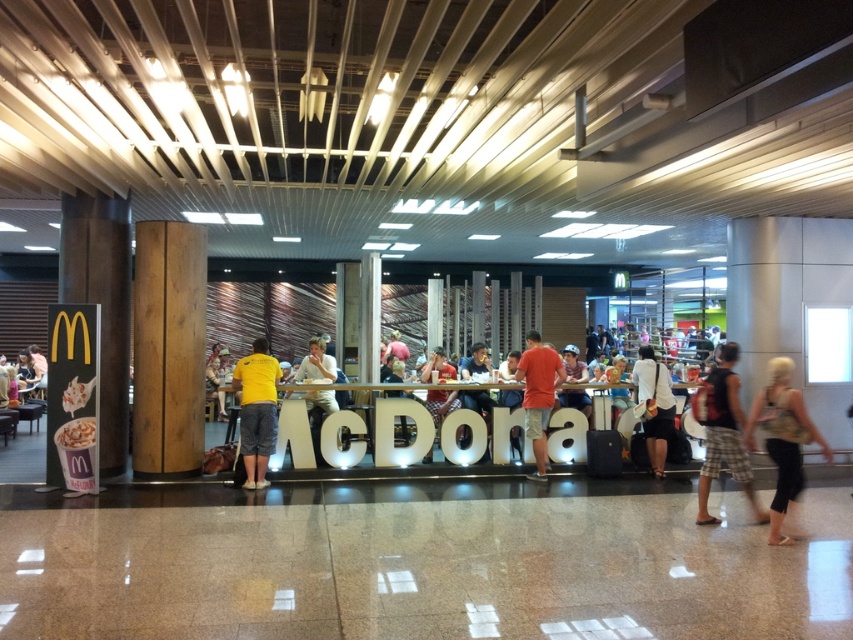
The image size is (853, 640). Describe the element at coordinates (654, 404) in the screenshot. I see `white fabric bag at center` at that location.

Who is higher up, white fabric bag at center or matte white shirt at center?

matte white shirt at center

Between point (654, 428) and point (328, 406), which one is positioned behind?

Positioned behind is point (328, 406).

Where is `white fabric bag at center`? The image size is (853, 640). white fabric bag at center is located at coordinates (654, 404).

Does matte orange t-shirt at center have a smaller size compared to matte white shirt at center?

Indeed, matte orange t-shirt at center has a smaller size compared to matte white shirt at center.

Which is more to the left, matte orange t-shirt at center or matte white shirt at center?

Positioned to the left is matte white shirt at center.

Is point (541, 481) more distant than point (335, 372)?

No, (541, 481) is closer to viewer.

Find the location of `matte orange t-shirt at center`. matte orange t-shirt at center is located at coordinates (538, 394).

Is point (703, 465) farther from viewer compared to point (525, 352)?

No.

The width and height of the screenshot is (853, 640). Find the location of `camouflage shorts at right`. camouflage shorts at right is located at coordinates (724, 435).